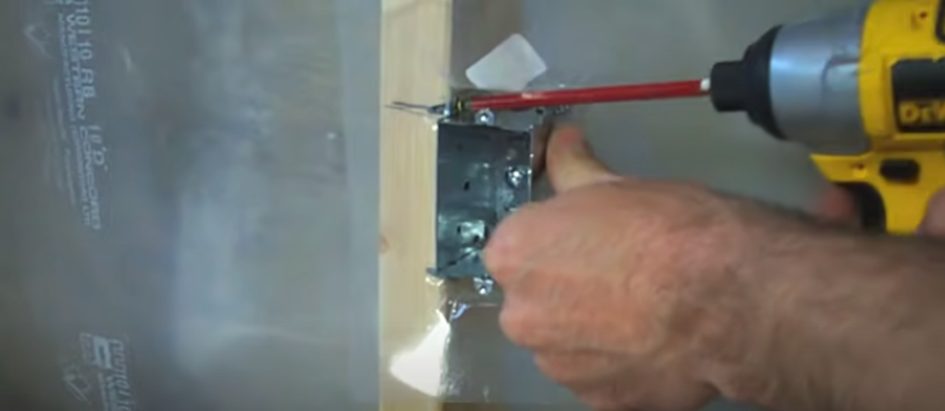
Where is `screws in electrical box`? screws in electrical box is located at coordinates (516, 181), (455, 107).